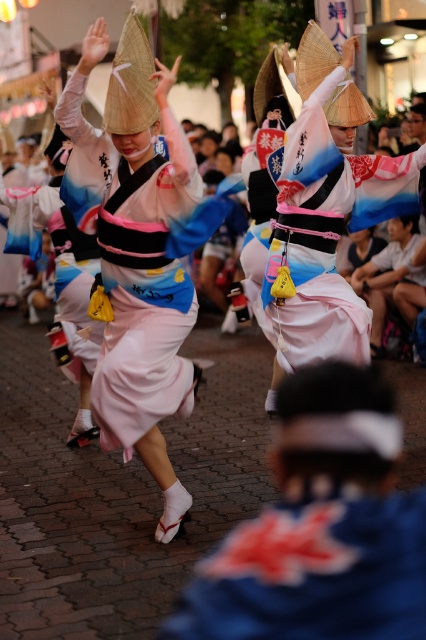
Is point (195, 636) positioned after point (304, 240)?

No, (195, 636) is closer to viewer.

Can you confirm if blue silk kimono at center is smaller than matte pink kimono at center?

Correct, blue silk kimono at center occupies less space than matte pink kimono at center.

Is point (238, 532) positioned after point (328, 291)?

No, it is not.

You are a GUI agent. You are given a task and a screenshot of the screen. Output one action in this format:
    pyautogui.click(x=<x>, y=<y>)
    Task: Click on the blue silk kimono at center
    This screenshot has width=426, height=640.
    Given the screenshot: What is the action you would take?
    click(x=313, y=572)